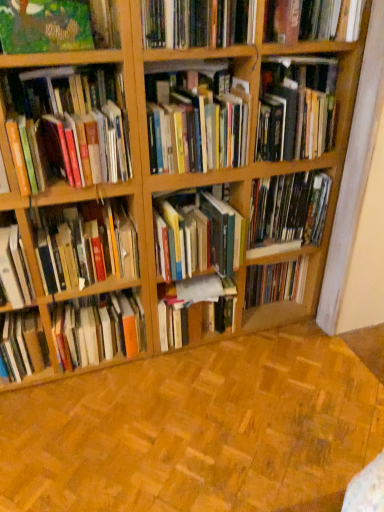
Question: Does hardcover book at center, placed as the 7th book when sorted from bottom to top, come in front of hardcover book at upper right, marked as the fourth book in a top-to-bottom arrangement?

Choices:
 (A) no
 (B) yes

Answer: (A)

Question: Does hardcover book at center, the 7th book viewed from the top, have a smaller size compared to hardcover book at upper right, the 10th book ordered from the bottom?

Choices:
 (A) yes
 (B) no

Answer: (B)

Question: From a real-world perspective, is hardcover book at center, placed as the 7th book when sorted from bottom to top, located higher than hardcover book at upper right, the 10th book ordered from the bottom?

Choices:
 (A) yes
 (B) no

Answer: (B)

Question: Is hardcover book at center, placed as the 7th book when sorted from bottom to top, oriented towards hardcover book at upper right, marked as the fourth book in a top-to-bottom arrangement?

Choices:
 (A) yes
 (B) no

Answer: (B)

Question: From the image's perspective, is hardcover book at center, placed as the 7th book when sorted from bottom to top, below hardcover book at upper right, the 10th book ordered from the bottom?

Choices:
 (A) no
 (B) yes

Answer: (B)

Question: Is hardcover book at center, the 7th book viewed from the top, to the right of hardcover book at upper right, the 10th book ordered from the bottom, from the viewer's perspective?

Choices:
 (A) no
 (B) yes

Answer: (A)

Question: From a real-world perspective, is hardcover books at center, marked as the 9th book in a bottom-to-top arrangement, beneath green matte painting at upper left, arranged as the eleventh book when ordered from the bottom?

Choices:
 (A) yes
 (B) no

Answer: (A)

Question: Is hardcover books at center, marked as the 9th book in a bottom-to-top arrangement, positioned before green matte painting at upper left, which appears as the third book when viewed from the top?

Choices:
 (A) no
 (B) yes

Answer: (A)

Question: Is hardcover books at center, placed as the 5th book when sorted from top to bottom, positioned with its back to green matte painting at upper left, which appears as the third book when viewed from the top?

Choices:
 (A) no
 (B) yes

Answer: (A)

Question: Is hardcover books at center, placed as the 5th book when sorted from top to bottom, oriented towards green matte painting at upper left, which appears as the third book when viewed from the top?

Choices:
 (A) no
 (B) yes

Answer: (A)

Question: Is hardcover books at center, placed as the 5th book when sorted from top to bottom, outside of green matte painting at upper left, which appears as the third book when viewed from the top?

Choices:
 (A) no
 (B) yes

Answer: (B)

Question: Considering the relative sizes of hardcover books at center, marked as the 9th book in a bottom-to-top arrangement, and green matte painting at upper left, arranged as the eleventh book when ordered from the bottom, in the image provided, is hardcover books at center, marked as the 9th book in a bottom-to-top arrangement, shorter than green matte painting at upper left, arranged as the eleventh book when ordered from the bottom,?

Choices:
 (A) yes
 (B) no

Answer: (B)

Question: From the image's perspective, is hardcover books at center, placed as the 5th book when sorted from top to bottom, on top of hardcover book at upper center, marked as the 2th book in a top-to-bottom arrangement?

Choices:
 (A) yes
 (B) no

Answer: (B)